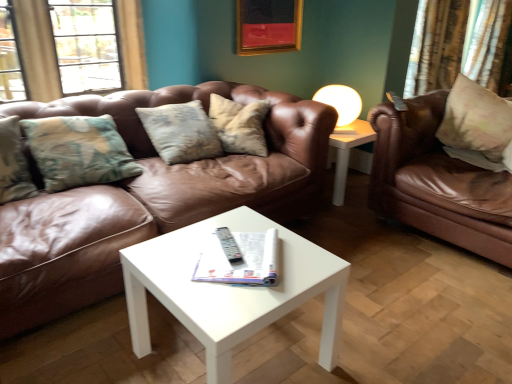
I want to click on vacant space positioned to the left of white glossy coffee table at center, so click(x=93, y=343).